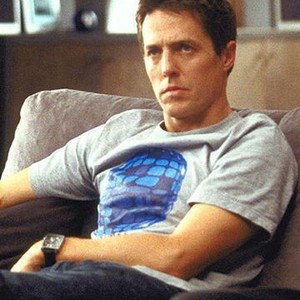
The width and height of the screenshot is (300, 300). What are the coordinates of `globe` in the screenshot? It's located at (86, 20).